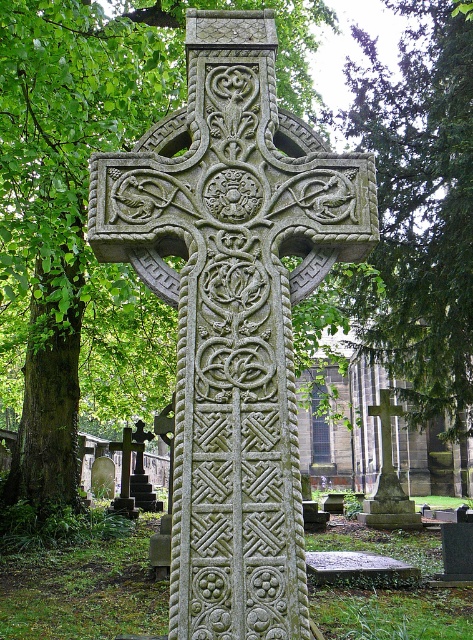
You are a visitor at the cemetery and want to take a photo of the smooth stone cross at center. You notice the green leafy tree at center is blocking part of the cross. Which direction should you move to avoid the tree blocking the cross?

The green leafy tree at center is positioned on the left side of the smooth stone cross at center. To avoid the tree blocking the cross, you should move to the right side of the cross.

In the scene shown: You are standing in front of the large stone cross in the cemetery. There is a point marked at coordinates (86, 196). What object is located at this point?

The point at coordinates (86, 196) indicates a green leafy tree at center.

You are a landscape architect planning to install a new pathway between the green leafy tree at center and the smooth stone cross at center. The pathway requires a minimum of 3 meters of space. Can the pathway be installed between them?

The distance between the green leafy tree at center and the smooth stone cross at center is 4.29 meters, which exceeds the required 3 meters. Therefore, the pathway can be installed between them.